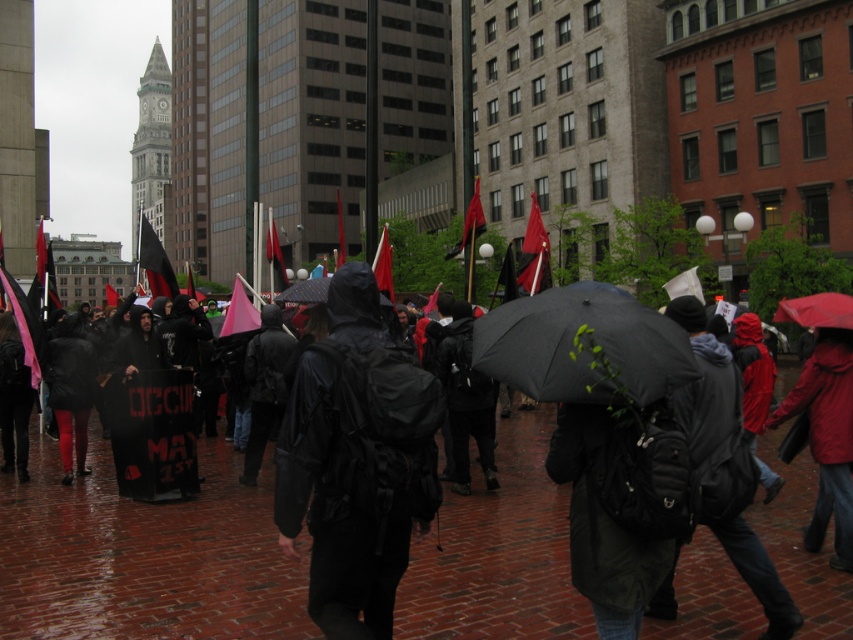
Can you confirm if black matte umbrella at center is positioned above red fabric flag at upper center?

Actually, black matte umbrella at center is below red fabric flag at upper center.

Which is more to the left, black matte umbrella at center or red fabric flag at upper center?

black matte umbrella at center is more to the left.

Does point (628, 340) come behind point (520, 260)?

No.

Where is `black matte umbrella at center`? The height and width of the screenshot is (640, 853). black matte umbrella at center is located at coordinates (583, 346).

Can you confirm if brick pavement at center is thinner than black matte jacket at center?

No.

Is brick pavement at center further to camera compared to black matte jacket at center?

Yes, it is.

What do you see at coordinates (144, 556) in the screenshot? I see `brick pavement at center` at bounding box center [144, 556].

The height and width of the screenshot is (640, 853). I want to click on brick pavement at center, so (144, 556).

Can you confirm if red matte umbrella at right is positioned to the left of red fabric flag at upper center?

No, red matte umbrella at right is not to the left of red fabric flag at upper center.

Can you confirm if red matte umbrella at right is bigger than red fabric flag at upper center?

Yes.

Who is more distant from viewer, (822, 305) or (544, 268)?

Point (544, 268)

Where is `red matte umbrella at right`? The image size is (853, 640). red matte umbrella at right is located at coordinates (817, 310).